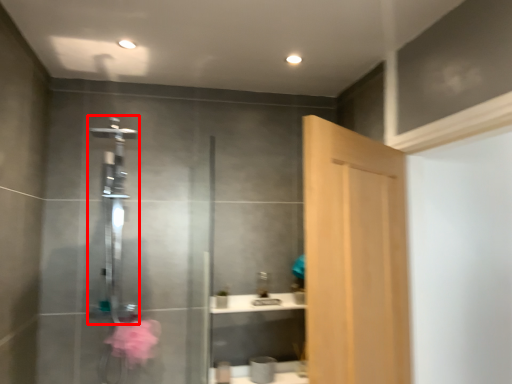
Question: From the image's perspective, what is the correct spatial positioning of shower (annotated by the red box) in reference to door?

Choices:
 (A) below
 (B) above

Answer: (A)